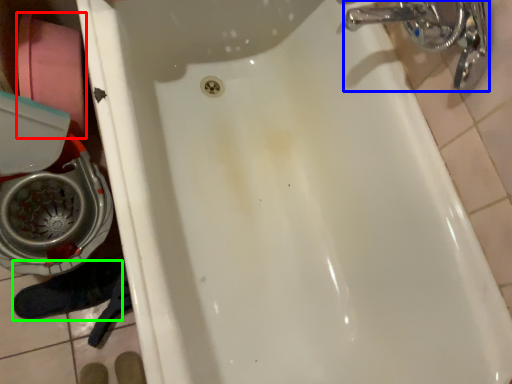
Question: Based on their relative distances, which object is nearer to toilet paper (highlighted by a red box)? Choose from plumbing fixture (highlighted by a blue box) and shoe (highlighted by a green box).

Choices:
 (A) plumbing fixture
 (B) shoe

Answer: (B)